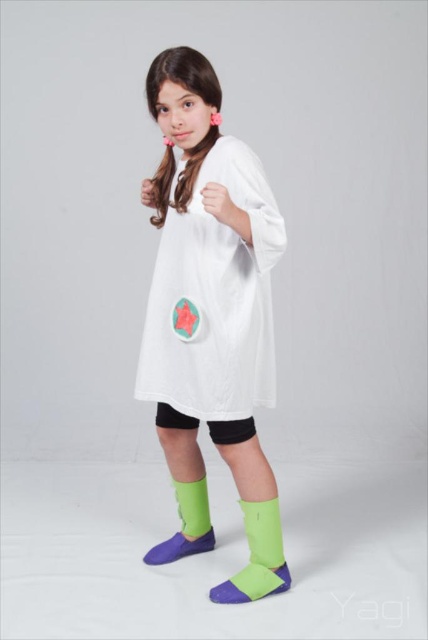
You are a costume designer preparing to alter the outfit of the individual in the image. You need to ensure that the white matte dress at center and the green fabric sock at lower center are proportionate. Based on their current sizes, which item should you adjust to achieve a more balanced look?

The white matte dress at center is larger than the green fabric sock at lower center. To achieve a more balanced look, you should reduce the size of the white matte dress at center or increase the size of the green fabric sock at lower center.

You are a costume designer trying to determine the correct placement of accessories for the character. Given that the green fabric boot at lower center and the green fabric sock at lower center are both part of the costume, which one should be placed lower on the leg to ensure proper visibility?

The green fabric boot at lower center should be placed lower on the leg since it is bigger than the green fabric sock at lower center, allowing it to be more visible at the bottom of the leg.